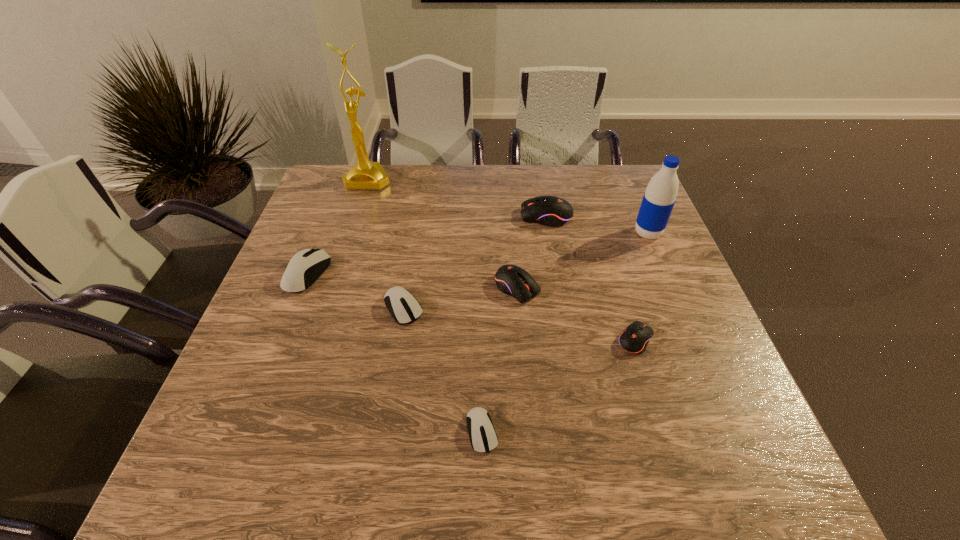
Locate an element on the screen. vacant space positioned 0.190m on the front of the second smallest white mouse is located at coordinates (388, 404).

Find the location of `vacant space situated 0.220m on the left of the nearest black computer mouse`. vacant space situated 0.220m on the left of the nearest black computer mouse is located at coordinates (516, 340).

Find the location of `free space located on the left of the smallest white mouse`. free space located on the left of the smallest white mouse is located at coordinates (254, 431).

Image resolution: width=960 pixels, height=540 pixels. Find the location of `award that is at the far edge`. award that is at the far edge is located at coordinates (368, 175).

Find the location of `computer mouse present at the far edge`. computer mouse present at the far edge is located at coordinates (x=552, y=211).

Where is `object at the near edge`? The width and height of the screenshot is (960, 540). object at the near edge is located at coordinates (483, 438).

Identify the location of award that is at the left edge. The width and height of the screenshot is (960, 540). (368, 175).

The width and height of the screenshot is (960, 540). What are the coordinates of `mouse located at the left edge` in the screenshot? It's located at (306, 266).

Identify the location of water bottle that is at the right edge. This screenshot has width=960, height=540. (659, 198).

Where is `computer mouse situated at the right edge`? Image resolution: width=960 pixels, height=540 pixels. computer mouse situated at the right edge is located at coordinates (635, 338).